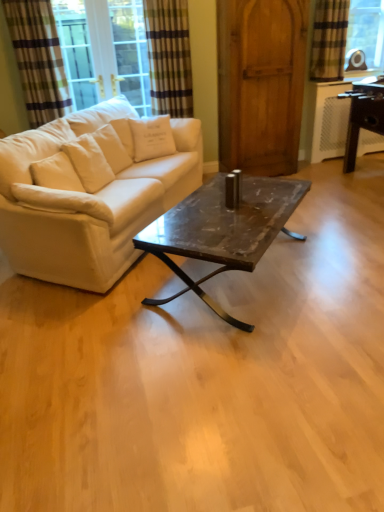
Find the location of a particular element. The width and height of the screenshot is (384, 512). vacant area that is in front of white fabric couch at left is located at coordinates (150, 354).